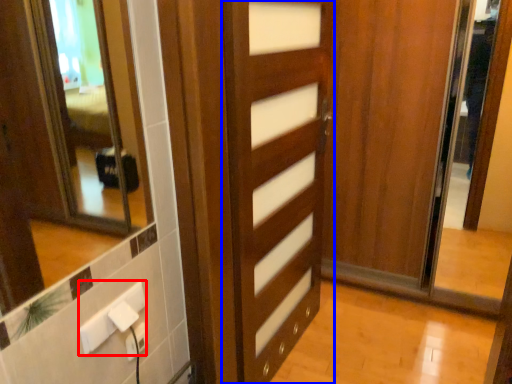
Question: Which point is closer to the camera, electric outlet (highlighted by a red box) or door (highlighted by a blue box)?

Choices:
 (A) electric outlet
 (B) door

Answer: (A)